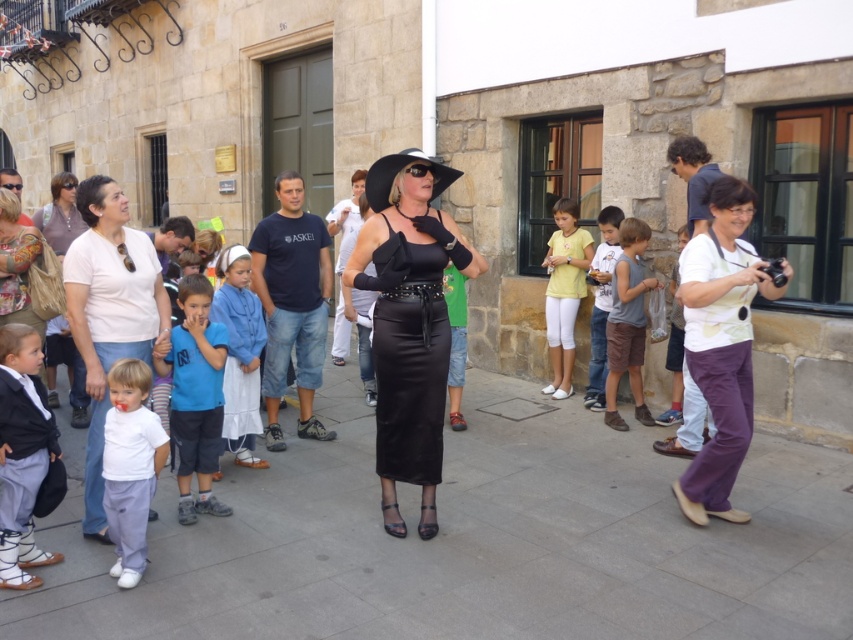
You are a photographer trying to capture a group photo of the crowd in the scene. You notice two people wearing a white matte shirt at left and a blue cotton shirt at center. Which of these two shirts is wider?

The white matte shirt at left is wider than the blue cotton shirt at center.

You are a photographer trying to capture the crowd in the scene. You notice the white matte shirt at left and the blue cotton shirt at center. Which shirt is covering part of the other?

The white matte shirt at left is positioned over blue cotton shirt at center, so it is covering part of the blue cotton shirt at center.